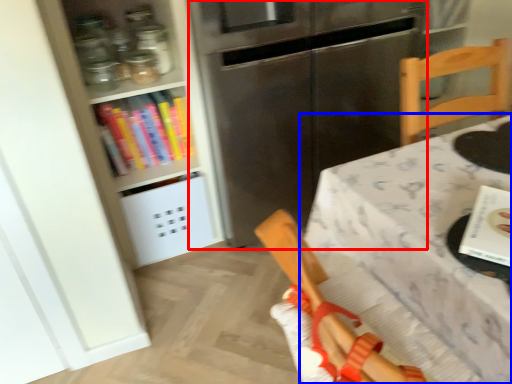
Question: Among these objects, which one is farthest to the camera, fridge (highlighted by a red box) or table (highlighted by a blue box)?

Choices:
 (A) fridge
 (B) table

Answer: (A)